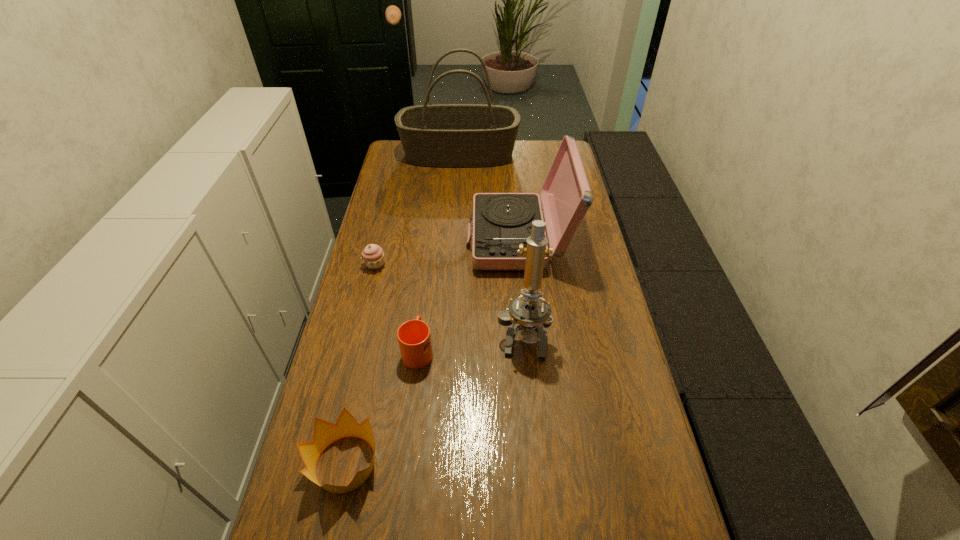
Where is `vacant area that lies between the basket and the cupcake`? The height and width of the screenshot is (540, 960). vacant area that lies between the basket and the cupcake is located at coordinates (418, 210).

Image resolution: width=960 pixels, height=540 pixels. In order to click on free space between the mug and the cupcake in this screenshot , I will do `click(396, 307)`.

Where is `free space between the crown and the microscope`? This screenshot has width=960, height=540. free space between the crown and the microscope is located at coordinates (434, 399).

The width and height of the screenshot is (960, 540). I want to click on vacant space that is in between the microscope and the nearest object, so click(x=434, y=399).

You are a GUI agent. You are given a task and a screenshot of the screen. Output one action in this format:
    pyautogui.click(x=<x>, y=<y>)
    Task: Click on the object that is the fifth nearest to the fourth shortest object
    Image resolution: width=960 pixels, height=540 pixels.
    Given the screenshot: What is the action you would take?
    pyautogui.click(x=325, y=433)

Identify which object is the fifth nearest to the record player. Please provide its 2D coordinates. Your answer should be formatted as a tuple, i.e. [(x, y)], where the tuple contains the x and y coordinates of a point satisfying the conditions above.

[(325, 433)]

Identify the location of vacant space that satisfies the following two spatial constraints: 1. with the lid open on the fourth shortest object; 2. on the front side of the crown. This screenshot has width=960, height=540. (540, 464).

What are the coordinates of `vacant point that satisfies the following two spatial constraints: 1. on the front side of the cupcake; 2. on the left side of the microscope` in the screenshot? It's located at (358, 335).